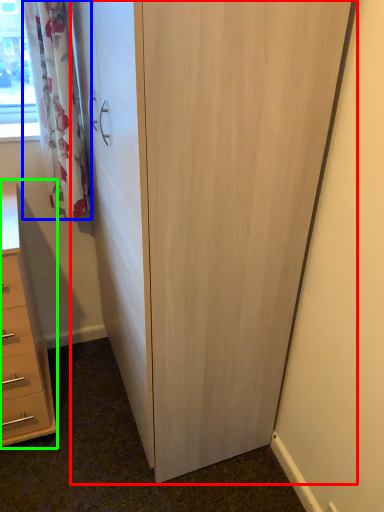
Question: Considering the real-world distances, which object is farthest from cupboard (highlighted by a red box)? curtain (highlighted by a blue box) or chest of drawers (highlighted by a green box)?

Choices:
 (A) curtain
 (B) chest of drawers

Answer: (B)